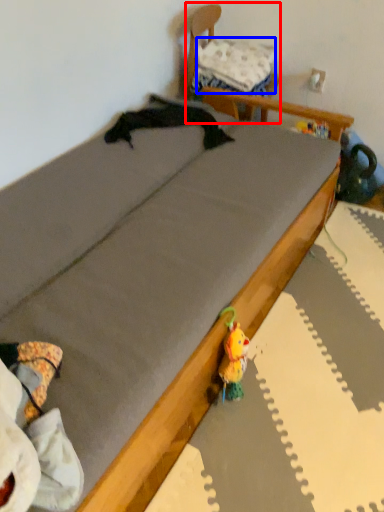
Question: Among these objects, which one is nearest to the camera, furniture (highlighted by a red box) or pillow (highlighted by a blue box)?

Choices:
 (A) furniture
 (B) pillow

Answer: (A)